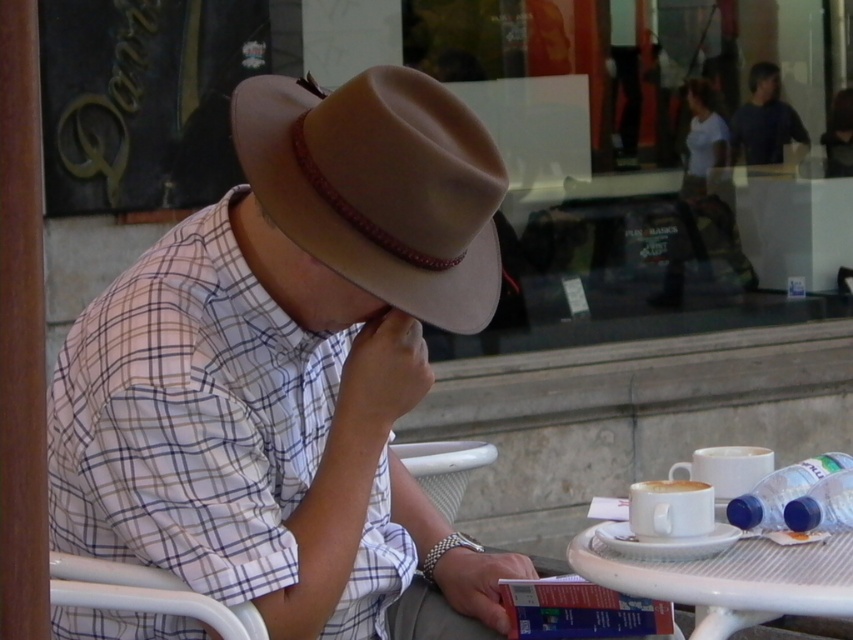
You are a barista at the outdoor cafe and need to place a new cup of coffee that is 5 inches in diameter on the table. Can the white matte cup at lower right fit on the white plastic table at lower right without falling off?

The distance between the white plastic table at lower right and the white matte cup at lower right is 4.72 inches. Since the new cup is 5 inches in diameter, it would not fit within the available space, so it might fall off or not fit properly.

You are standing at the edge of the outdoor cafe table and want to reach both points on the table surface. Which point, point 1 at coordinates (247, 138) or point 2 at coordinates (772, 593), is closer to you?

Point 1 at coordinates (247, 138) is closer to you because it is further to the camera than point 2 at coordinates (772, 593), which means it is closer in the observer perspective.

You are a barista at the outdoor cafe and need to place a new coffee cup on the table. The table has limited space between the matte brown hat at center and the suede brown fedora at center. Which object should you move to make room, and why?

The matte brown hat at center is wider than the suede brown fedora at center, so moving the suede brown fedora at center would free up more space for the new coffee cup.